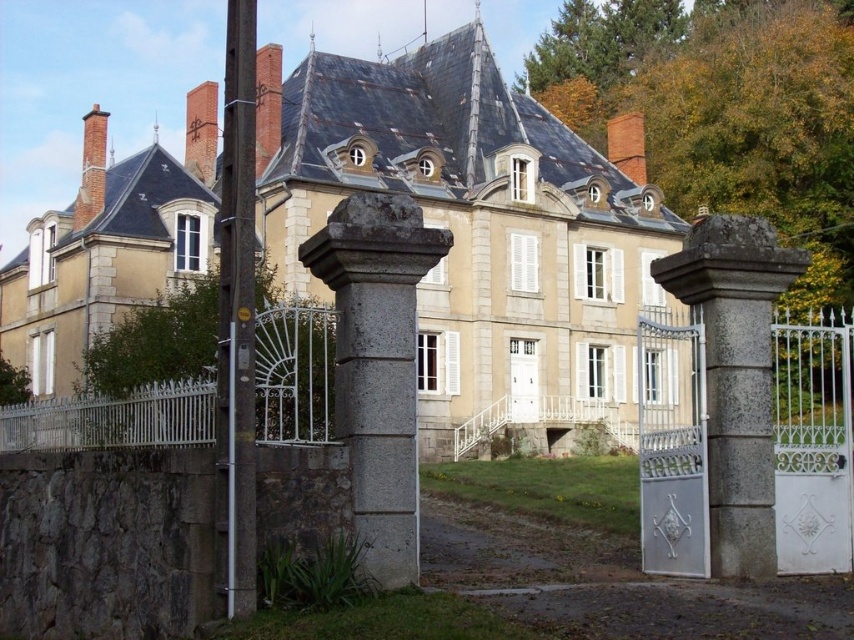
Question: Is the position of beige stone mansion at center more distant than that of gray stone gate at center?

Choices:
 (A) no
 (B) yes

Answer: (B)

Question: Which object is the farthest from the beige stone mansion at center?

Choices:
 (A) gray stone pillar at center
 (B) brown wooden pole at left
 (C) gray stone gate at center

Answer: (A)

Question: Estimate the real-world distances between objects in this image. Which object is farther from the gray stone pillar at center?

Choices:
 (A) brown wooden pole at left
 (B) gray stone gate at center
 (C) beige stone mansion at center

Answer: (C)

Question: Which of the following is the closest to the observer?

Choices:
 (A) (679, 276)
 (B) (349, 483)
 (C) (250, 20)
 (D) (641, 186)

Answer: (C)

Question: Is beige stone mansion at center smaller than gray stone gate at center?

Choices:
 (A) yes
 (B) no

Answer: (B)

Question: Does beige stone mansion at center appear over gray stone pillar at center?

Choices:
 (A) yes
 (B) no

Answer: (A)